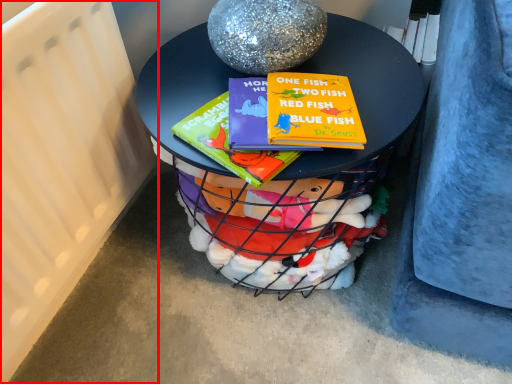
Question: From the image's perspective, what is the correct spatial positioning of radiator (annotated by the red box) in reference to table?

Choices:
 (A) above
 (B) below

Answer: (A)